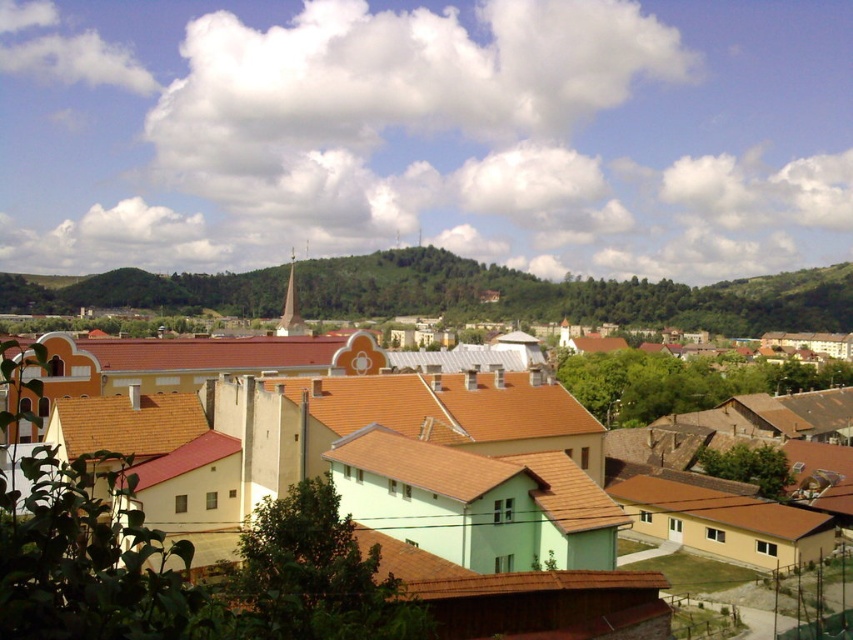
You are standing in the town square and want to take a photo of the brown tile roof at center and the green leafy hillside at center. Based on their positions, which one should you include on the left side of your photo?

The green leafy hillside at center is to the left of the brown tile roof at center, so you should include the green leafy hillside at center on the left side of your photo.

You are an architect visiting the town and want to assess the spatial relationship between the yellow matte building at center and the green leafy hillside at center. Based on the scene, which of these two objects occupies a smaller horizontal space?

The yellow matte building at center has a lesser width compared to the green leafy hillside at center, so it occupies a smaller horizontal space.

You are a drone operator who needs to fly a drone from the yellow matte building at center to the green leafy hillside at center. The drone has a maximum range of 300 meters. Can the drone complete this flight without needing to recharge?

The yellow matte building at center is 289.80 meters from the green leafy hillside at center. Since the distance is within the drone operator drone has a maximum range of 300 meters, the drone can complete the flight without needing to recharge.